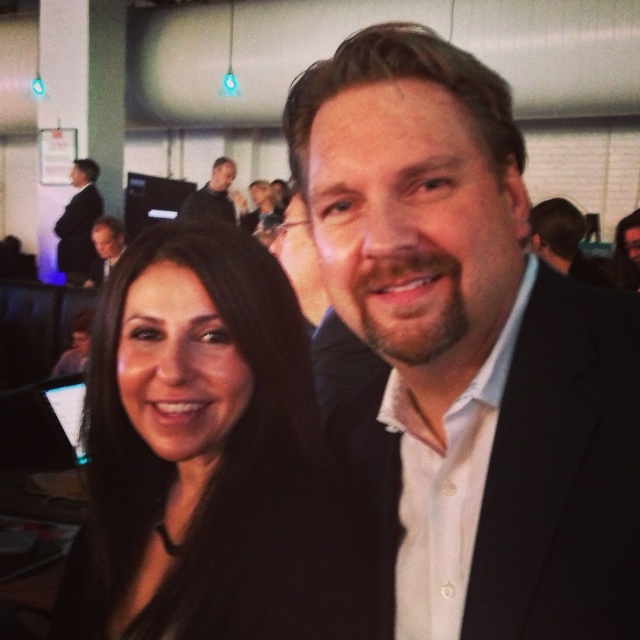
You are organizing a charity event and need to determine which item takes up more space on the image between the black fabric at left and the dark gray suit at upper center. Which one should you choose for a larger display?

The dark gray suit at upper center takes up more space on the image than the black fabric at left, so you should choose the dark gray suit at upper center for a larger display.

Based on the scene described, what object is located at the coordinate point (212, 195)?

The dark gray suit at upper center is located at the coordinate point (212, 195).